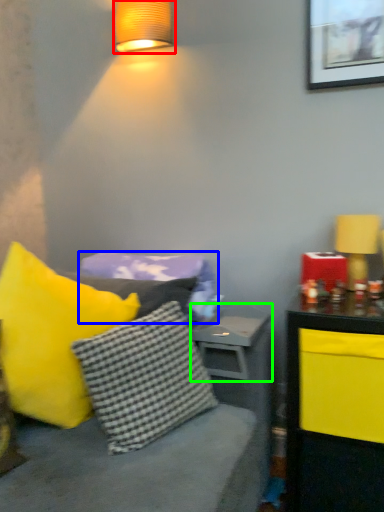
Question: Which is nearer to the lamp (highlighted by a red box)? pillow (highlighted by a blue box) or table (highlighted by a green box).

Choices:
 (A) pillow
 (B) table

Answer: (A)